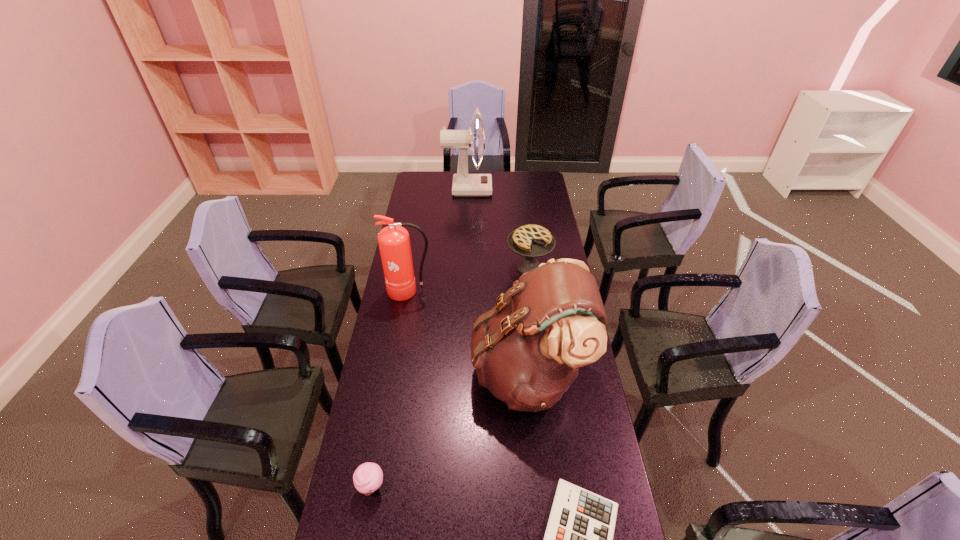
Where is `free space located on the cut side of the pie`? The height and width of the screenshot is (540, 960). free space located on the cut side of the pie is located at coordinates (532, 291).

Locate an element on the screen. vacant region located 0.360m on the back of the cupcake is located at coordinates (392, 373).

Find the location of a particular element. object at the far edge is located at coordinates (464, 184).

The width and height of the screenshot is (960, 540). I want to click on fire extinguisher situated at the left edge, so click(394, 243).

What are the coordinates of `cupcake that is at the left edge` in the screenshot? It's located at (368, 477).

The height and width of the screenshot is (540, 960). Identify the location of satchel that is at the right edge. (527, 350).

This screenshot has height=540, width=960. In order to click on pie present at the right edge in this screenshot , I will do `click(531, 241)`.

Identify the location of free space at the far edge of the desktop. Image resolution: width=960 pixels, height=540 pixels. (442, 187).

Where is `vacant region at the left edge`? This screenshot has width=960, height=540. vacant region at the left edge is located at coordinates (384, 359).

This screenshot has height=540, width=960. I want to click on vacant point at the right edge, so click(x=612, y=500).